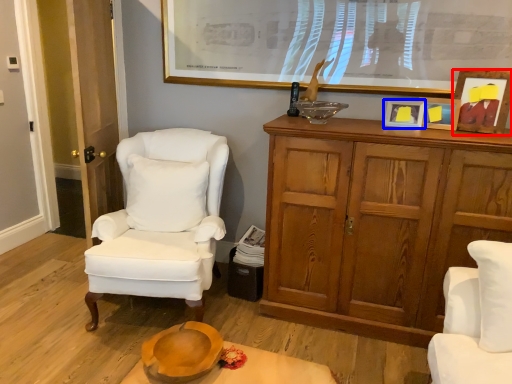
Question: Which object appears farthest to the camera in this image, picture frame (highlighted by a red box) or picture frame (highlighted by a blue box)?

Choices:
 (A) picture frame
 (B) picture frame

Answer: (B)